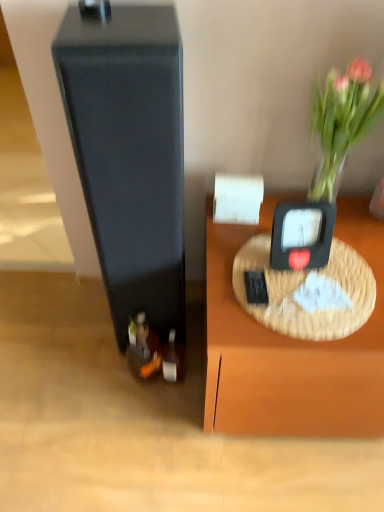
At what (x,y) coordinates should I click in order to perform the action: click on vacant space in front of shiny dark glass wine bottle at lower left, the 1th wine bottle viewed from the left. Please return your answer as a coordinate pair (x, y). The image size is (384, 512). Looking at the image, I should click on (147, 424).